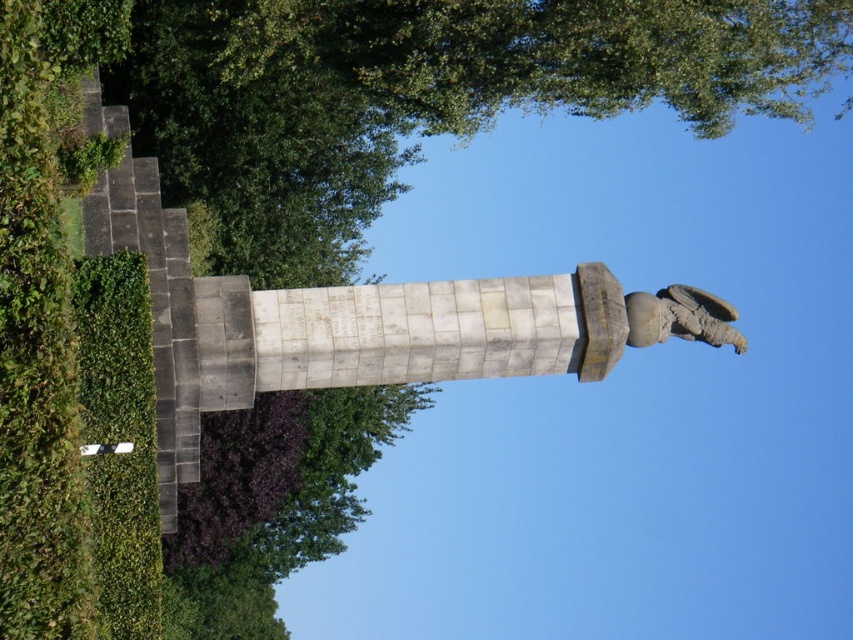
Question: Considering the relative positions of green leafy tree at upper center and stone statue at upper right in the image provided, where is green leafy tree at upper center located with respect to stone statue at upper right?

Choices:
 (A) below
 (B) above

Answer: (B)

Question: Does green leafy tree at upper center lie in front of stone statue at upper right?

Choices:
 (A) yes
 (B) no

Answer: (A)

Question: Which point is closer to the camera?

Choices:
 (A) green leafy tree at upper center
 (B) stone statue at upper right

Answer: (A)

Question: Considering the relative positions of green leafy tree at upper center and stone statue at upper right in the image provided, where is green leafy tree at upper center located with respect to stone statue at upper right?

Choices:
 (A) right
 (B) left

Answer: (B)